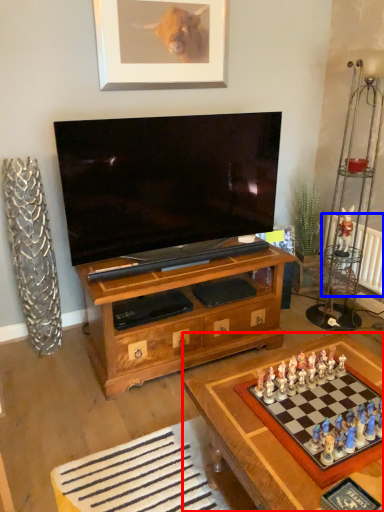
Question: Which object is closer to the camera taking this photo, table (highlighted by a red box) or radiator (highlighted by a blue box)?

Choices:
 (A) table
 (B) radiator

Answer: (A)